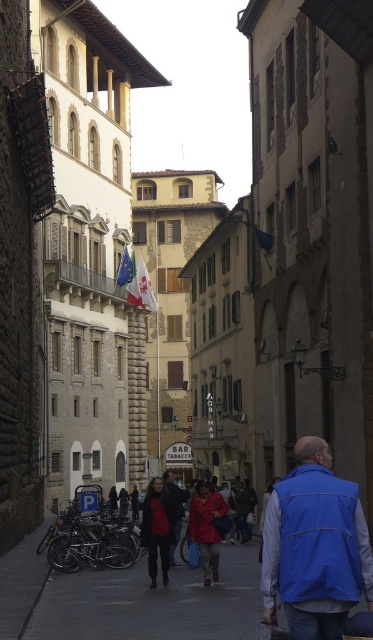
Can you confirm if blue softshell vest at center is thinner than red leather jacket at center?

No, blue softshell vest at center is not thinner than red leather jacket at center.

Does blue softshell vest at center appear on the right side of red leather jacket at center?

Indeed, blue softshell vest at center is positioned on the right side of red leather jacket at center.

Where is `blue softshell vest at center`? Image resolution: width=373 pixels, height=640 pixels. blue softshell vest at center is located at coordinates (315, 547).

Identify the location of blue softshell vest at center. The image size is (373, 640). (315, 547).

Is point (160, 532) less distant than point (127, 285)?

That is True.

Is matte black jacket at center taller than white fabric flag at upper center?

No.

Locate an element on the screen. This screenshot has height=640, width=373. matte black jacket at center is located at coordinates (157, 529).

Where is `matte black jacket at center`? This screenshot has width=373, height=640. matte black jacket at center is located at coordinates (157, 529).

Who is taller, blue softshell vest at center or matte black jacket at center?

With more height is blue softshell vest at center.

Identify the location of blue softshell vest at center. (315, 547).